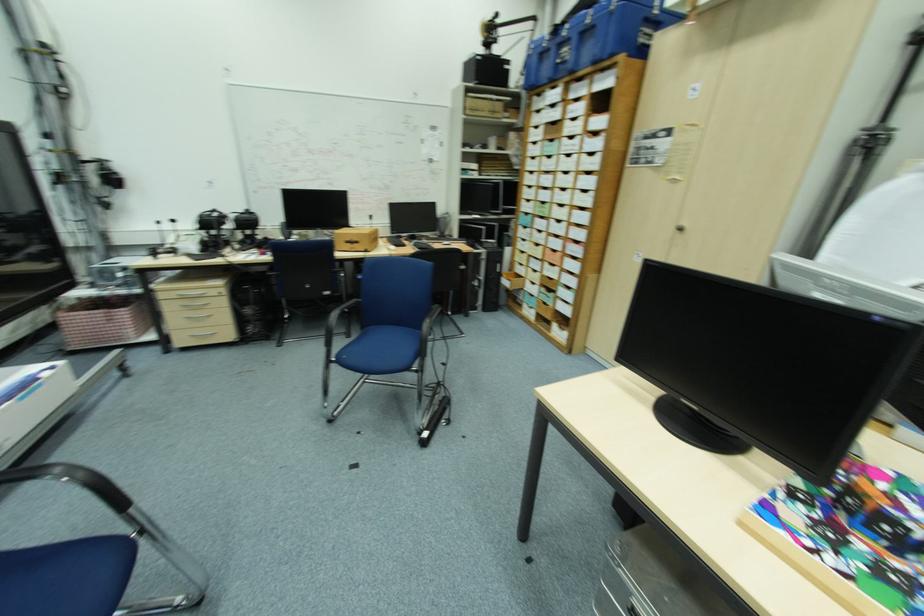
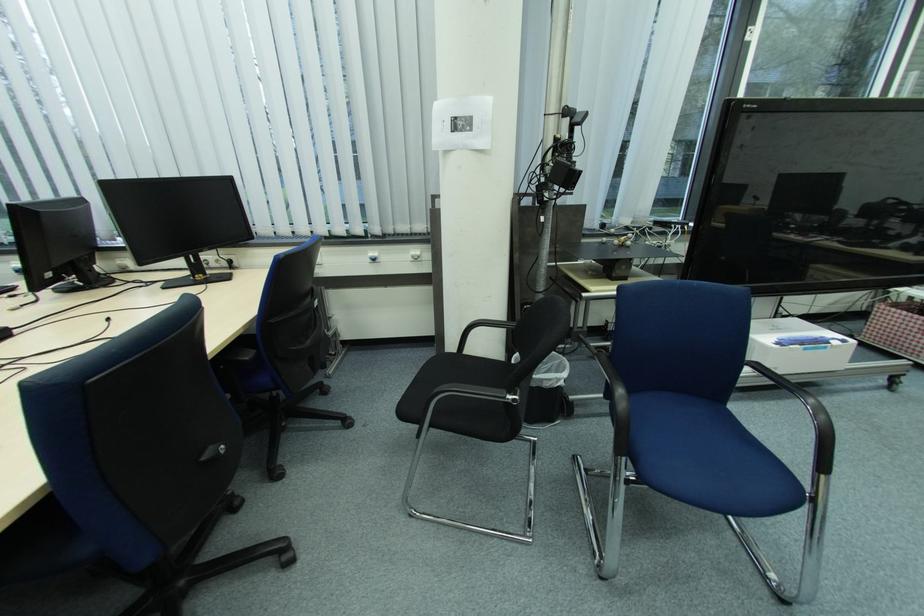
The first image is from the beginning of the video and the second image is from the end. How did the camera likely rotate when shooting the video?

The rotation direction of the camera is left-down.